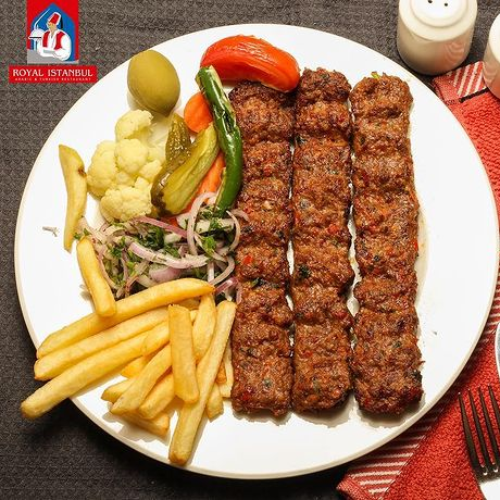
Find the location of a particular element. The width and height of the screenshot is (500, 500). plate is located at coordinates (423, 226).